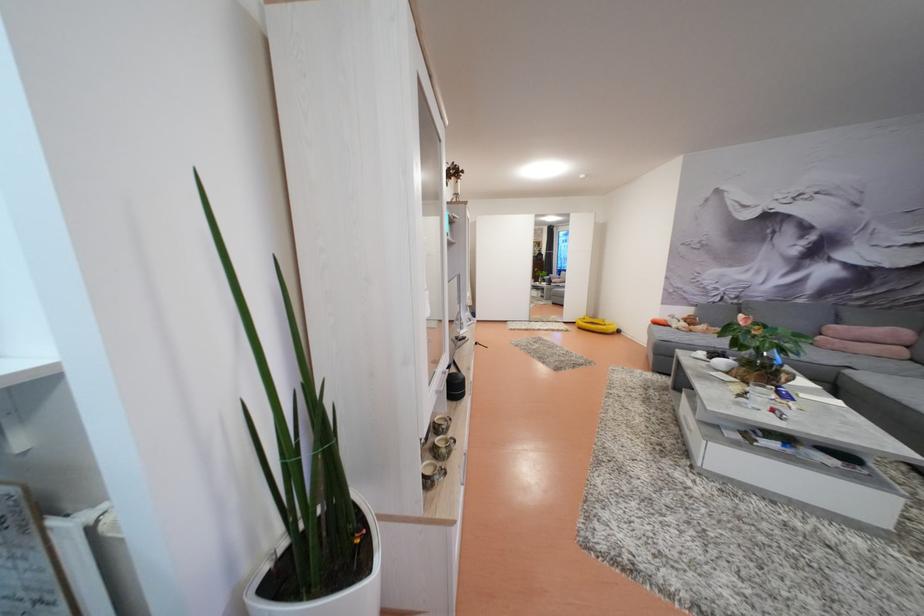
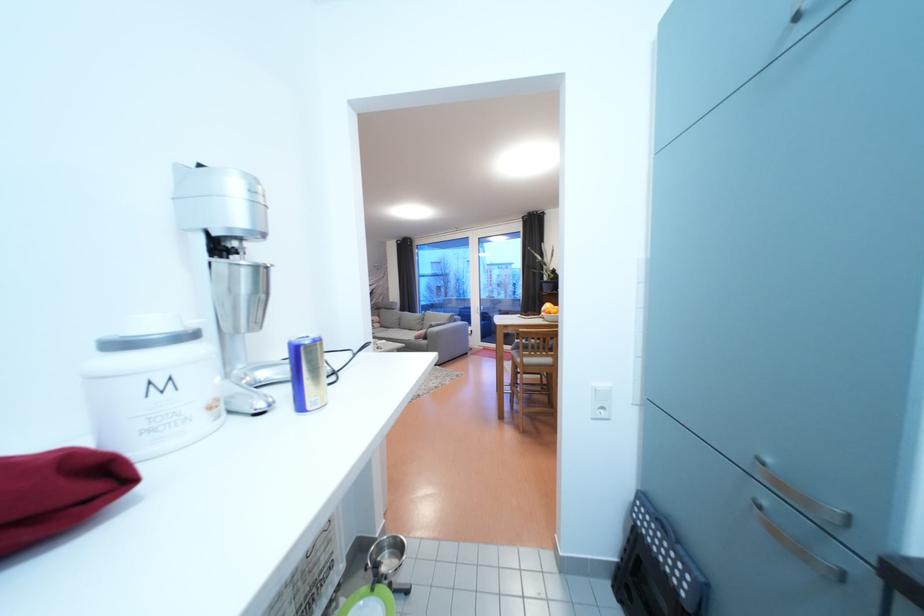
Question: I am providing you with two images of the same scene from different viewpoints. Which of the following objects are not visible in image2?

Choices:
 (A) metal mixer cup
 (B) small patterned cup
 (C) white container lid
 (D) black recessed handle

Answer: (B)